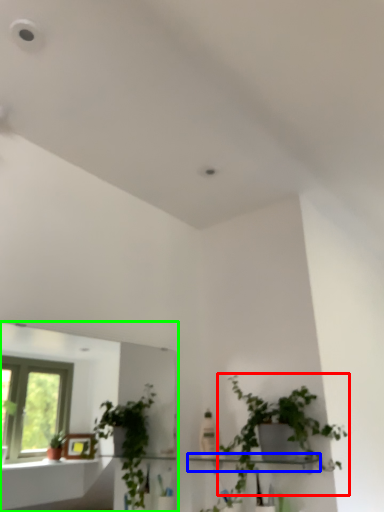
Question: Which object is positioned farthest from houseplant (highlighted by a red box)? Select from shelf (highlighted by a blue box) and mirror (highlighted by a green box).

Choices:
 (A) shelf
 (B) mirror

Answer: (B)